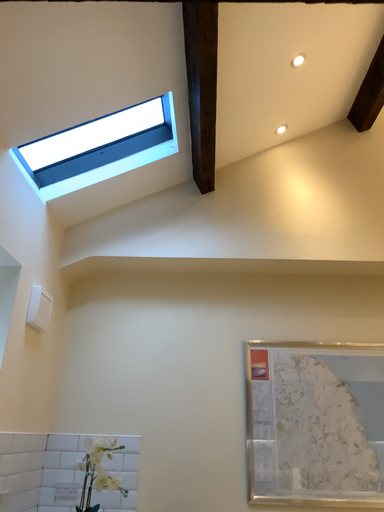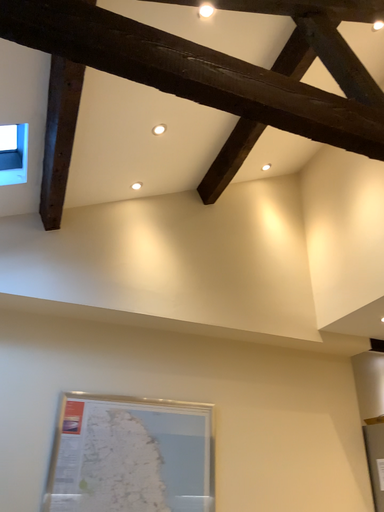
Question: Which way did the camera rotate in the video?

Choices:
 (A) rotated right
 (B) rotated left

Answer: (A)